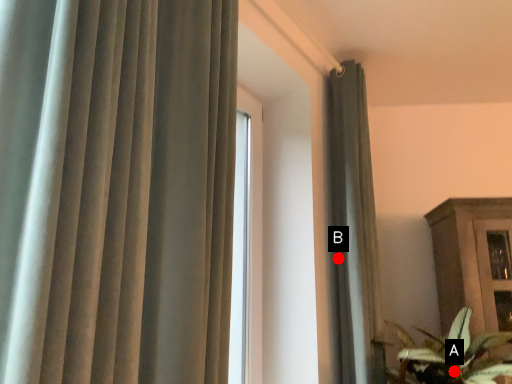
Question: Two points are circled on the image, labeled by A and B beside each circle. Which point is closer to the camera taking this photo?

Choices:
 (A) A is closer
 (B) B is closer

Answer: (A)